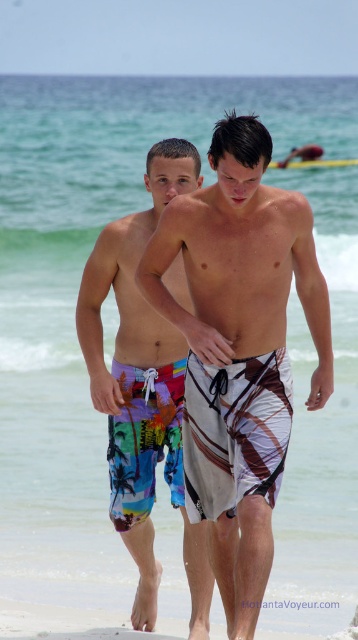
You are a photographer trying to capture the two men walking on the beach. Based on the image, which object is positioned higher up in the scene between the multicolored printed boardshorts at left and the white sand at lower center?

The multicolored printed boardshorts at left is much taller than the white sand at lower center, so it is positioned higher up in the scene.

You are standing on the beach and see two points marked on the sand. The first point is labeled as point (113,358) and the second is point (68,614). If you walk towards the ocean, which point will you pass first?

Since point (113,358) is behind point (68,614), you will pass point (68,614) first when walking towards the ocean.